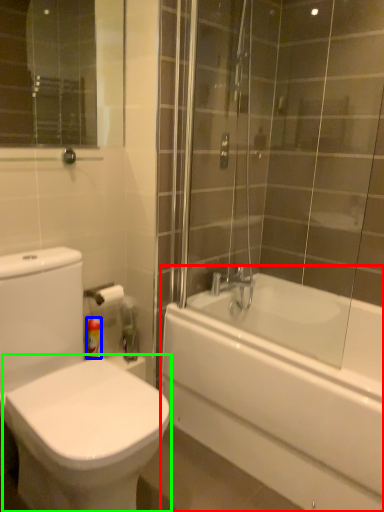
Question: Based on their relative distances, which object is nearer to bathtub (highlighted by a red box)? Choose from toiletry (highlighted by a blue box) and bidet (highlighted by a green box).

Choices:
 (A) toiletry
 (B) bidet

Answer: (B)